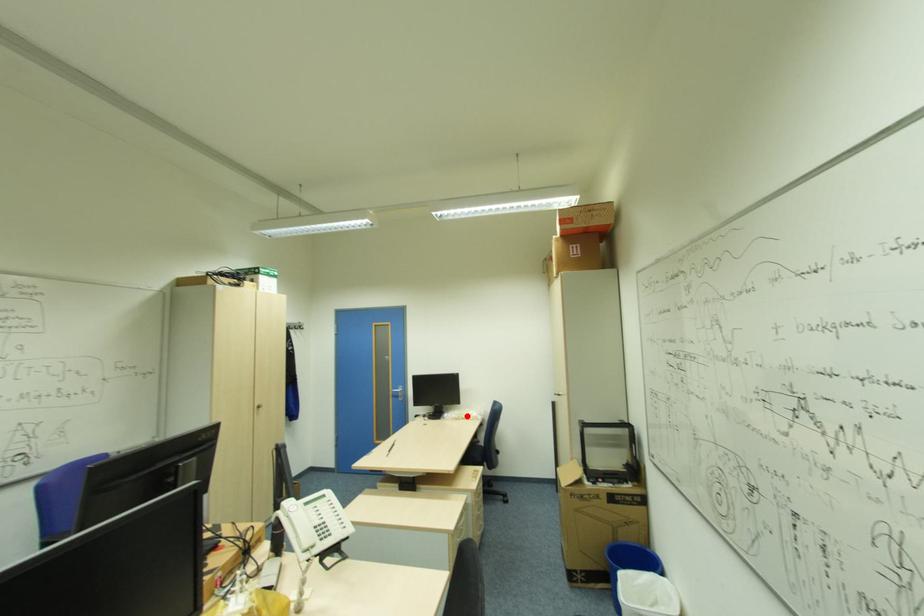
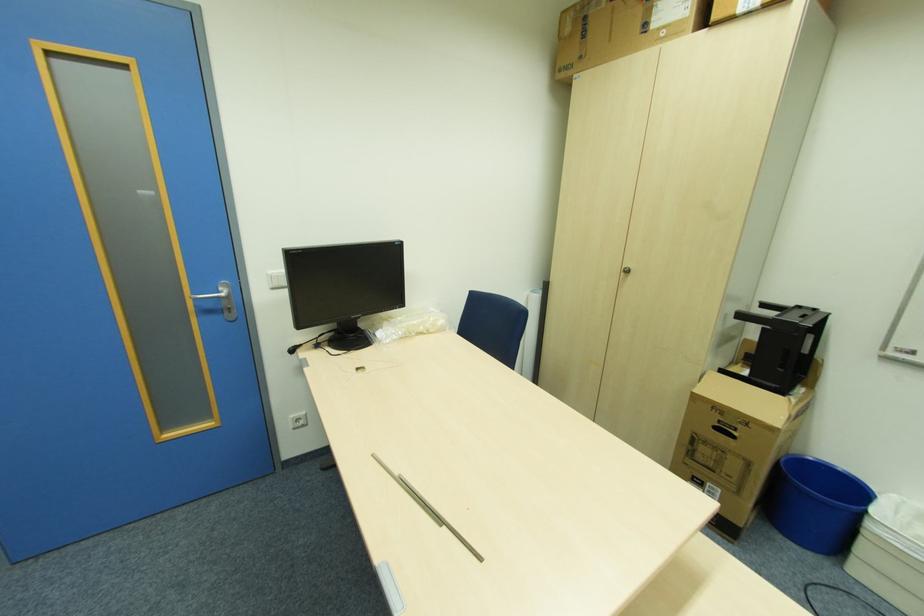
Find the pixel in the second image that matches the highlighted location in the first image.

(424, 329)